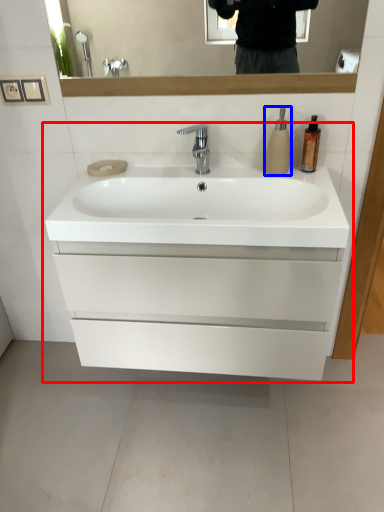
Question: Which of the following is the farthest to the observer, bathroom cabinet (highlighted by a red box) or soap dispenser (highlighted by a blue box)?

Choices:
 (A) bathroom cabinet
 (B) soap dispenser

Answer: (B)